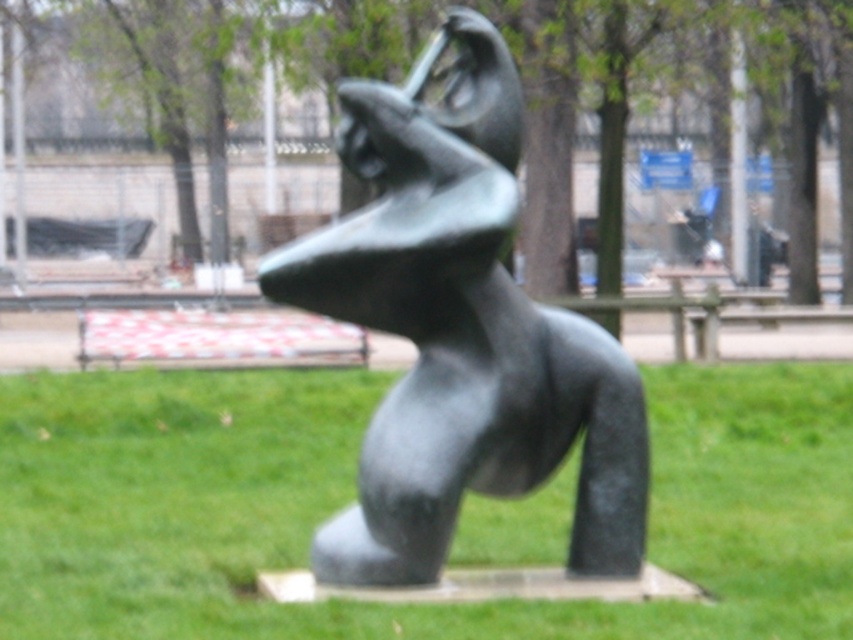
Question: Which object appears farthest from the camera in this image?

Choices:
 (A) green grass at center
 (B) bronze sculpture at center

Answer: (B)

Question: Among these points, which one is nearest to the camera?

Choices:
 (A) (399, 609)
 (B) (463, 307)

Answer: (A)

Question: Is green grass at center wider than bronze sculpture at center?

Choices:
 (A) yes
 (B) no

Answer: (A)

Question: Which point appears farthest from the camera in this image?

Choices:
 (A) (281, 272)
 (B) (337, 378)

Answer: (B)

Question: Is green grass at center further to camera compared to bronze sculpture at center?

Choices:
 (A) no
 (B) yes

Answer: (A)

Question: Does green grass at center lie behind bronze sculpture at center?

Choices:
 (A) no
 (B) yes

Answer: (A)